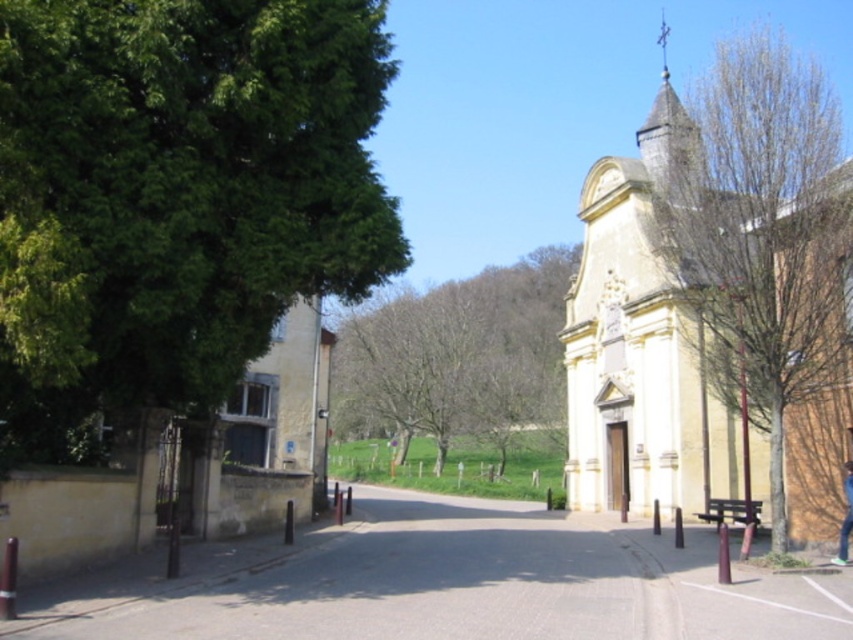
Question: Which point is farther from the camera taking this photo?

Choices:
 (A) (845, 552)
 (B) (480, 365)
 (C) (219, 180)
 (D) (590, 269)

Answer: (B)

Question: Which object appears farthest from the camera in this image?

Choices:
 (A) yellow stone church at right
 (B) green leafy tree at left

Answer: (A)

Question: Where is green leafy tree at left located in relation to blue jeans at lower right in the image?

Choices:
 (A) left
 (B) right

Answer: (A)

Question: Where is bare wood tree at center located in relation to blue jeans at lower right in the image?

Choices:
 (A) right
 (B) left

Answer: (B)

Question: Is green leafy tree at left to the left of yellow stone church at right from the viewer's perspective?

Choices:
 (A) no
 (B) yes

Answer: (B)

Question: Which is nearer to the green leafy tree at left?

Choices:
 (A) bare wood tree at center
 (B) blue jeans at lower right

Answer: (B)